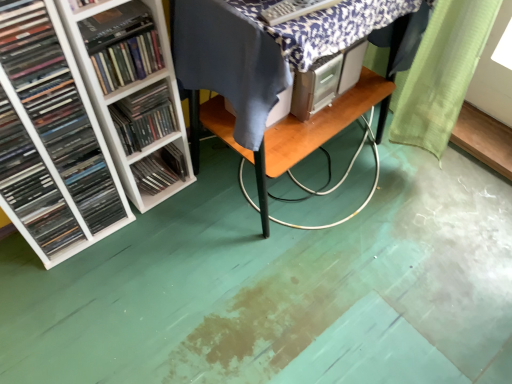
This screenshot has height=384, width=512. What are the coordinates of `vacant space to the right of matte black books at left, which ranks as the 3th book in right-to-left order` in the screenshot? It's located at (115, 253).